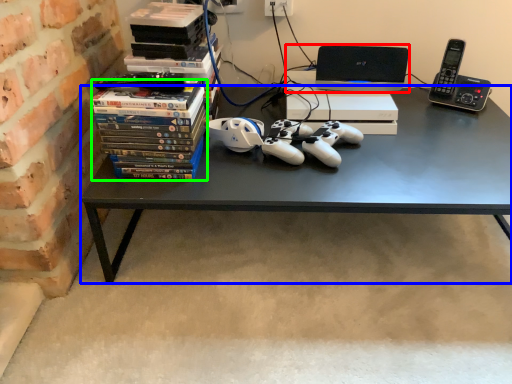
Question: Estimate the real-world distances between objects in this image. Which object is closer to computer (highlighted by a red box), desk (highlighted by a blue box) or book (highlighted by a green box)?

Choices:
 (A) desk
 (B) book

Answer: (A)